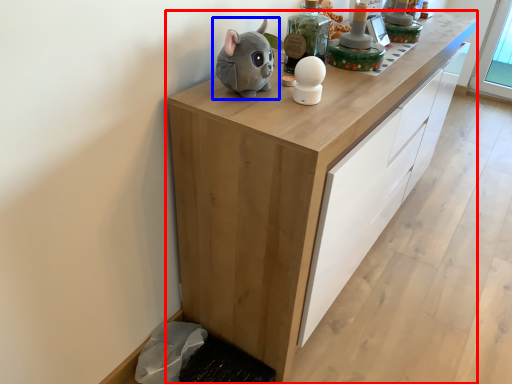
Question: Which of the following is the closest to the observer, cabinetry (highlighted by a red box) or toy (highlighted by a blue box)?

Choices:
 (A) cabinetry
 (B) toy

Answer: (A)